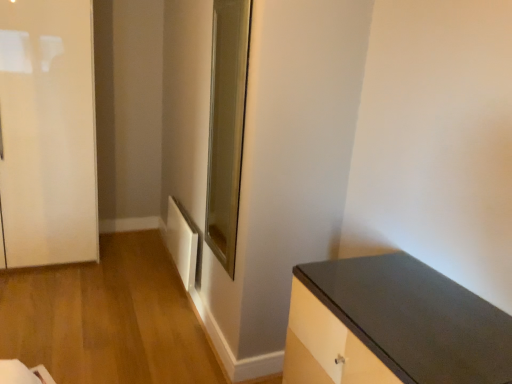
Where is `clear glass door at center`? Image resolution: width=512 pixels, height=384 pixels. clear glass door at center is located at coordinates (227, 126).

What is the approximate height of white glossy door at left?

The height of white glossy door at left is 1.91 meters.

Where is `clear glass door at center`? clear glass door at center is located at coordinates (227, 126).

From the picture: From the image's perspective, does white glossy door at left appear lower than matte black countertop at lower right?

No, from the image's perspective, white glossy door at left is not beneath matte black countertop at lower right.

From a real-world perspective, between white glossy door at left and matte black countertop at lower right, who is vertically lower?

matte black countertop at lower right is physically lower.

Would you say white glossy door at left is outside matte black countertop at lower right?

Absolutely, white glossy door at left is external to matte black countertop at lower right.

Does point (47, 171) appear closer or farther from the camera than point (371, 354)?

Point (47, 171).

From the image's perspective, between white matte radiator at lower left and matte black countertop at lower right, who is located below?

matte black countertop at lower right is shown below in the image.

Is white matte radiator at lower left not close to matte black countertop at lower right?

white matte radiator at lower left is positioned a significant distance from matte black countertop at lower right.

Does white matte radiator at lower left have a larger size compared to matte black countertop at lower right?

Actually, white matte radiator at lower left might be smaller than matte black countertop at lower right.

In terms of height, does white matte radiator at lower left look taller or shorter compared to matte black countertop at lower right?

In the image, white matte radiator at lower left appears to be shorter than matte black countertop at lower right.

Which is closer, [29,254] or [185,238]?

The point [185,238] is closer.

Is white glossy door at left directly adjacent to white matte radiator at lower left?

No, white glossy door at left is not next to white matte radiator at lower left.

Is white glossy door at left positioned behind white matte radiator at lower left?

No, it is in front of white matte radiator at lower left.

Is white glossy door at left with clear glass door at center?

white glossy door at left is not next to clear glass door at center, and they're not touching.

From the image's perspective, is white glossy door at left below clear glass door at center?

No, from the image's perspective, white glossy door at left is not below clear glass door at center.

Between white glossy door at left and clear glass door at center, which one appears on the left side from the viewer's perspective?

white glossy door at left is more to the left.

Looking at this image, could you tell me if white glossy door at left is turned towards clear glass door at center?

No, white glossy door at left does not turn towards clear glass door at center.

Which of these two, clear glass door at center or white matte radiator at lower left, is bigger?

clear glass door at center is bigger.

In the scene shown: Can you tell me how much clear glass door at center and white matte radiator at lower left differ in facing direction?

The facing directions of clear glass door at center and white matte radiator at lower left are 1.74 degrees apart.

Considering the relative positions of clear glass door at center and white matte radiator at lower left in the image provided, is clear glass door at center to the left of white matte radiator at lower left from the viewer's perspective?

In fact, clear glass door at center is to the right of white matte radiator at lower left.

Locate an element on the screen. This screenshot has width=512, height=384. radiator below the clear glass door at center (from a real-world perspective) is located at coordinates (182, 242).

From the image's perspective, is matte black countertop at lower right located beneath clear glass door at center?

Yes, from the image's perspective, matte black countertop at lower right is beneath clear glass door at center.

Between matte black countertop at lower right and clear glass door at center, which one is positioned behind?

clear glass door at center.

Would you say matte black countertop at lower right is to the left or to the right of clear glass door at center in the picture?

Based on their positions, matte black countertop at lower right is located to the right of clear glass door at center.

Is matte black countertop at lower right taller or shorter than clear glass door at center?

matte black countertop at lower right is shorter than clear glass door at center.

Relative to white glossy door at left, is clear glass door at center in front or behind?

Clearly, clear glass door at center is in front of white glossy door at left.

Considering the sizes of clear glass door at center and white glossy door at left in the image, is clear glass door at center wider or thinner than white glossy door at left?

clear glass door at center is thinner than white glossy door at left.

Is clear glass door at center oriented away from white glossy door at left?

clear glass door at center does not have its back to white glossy door at left.

What are the coordinates of `glass door that is in front of the white glossy door at left` in the screenshot? It's located at (227, 126).

The height and width of the screenshot is (384, 512). In the image, there is a white glossy door at left. In order to click on countertop below it (from the image's perspective) in this screenshot , I will do `click(392, 326)`.

In the image, there is a matte black countertop at lower right. At what (x,y) coordinates should I click in order to perform the action: click on radiator above it (from the image's perspective). Please return your answer as a coordinate pair (x, y). Looking at the image, I should click on (182, 242).

When comparing their distances from white matte radiator at lower left, does matte black countertop at lower right or white glossy door at left seem closer?

The object closer to white matte radiator at lower left is white glossy door at left.

Estimate the real-world distances between objects in this image. Which object is further from matte black countertop at lower right, white matte radiator at lower left or white glossy door at left?

The object further to matte black countertop at lower right is white glossy door at left.

When comparing their distances from white matte radiator at lower left, does white glossy door at left or matte black countertop at lower right seem further?

Among the two, matte black countertop at lower right is located further to white matte radiator at lower left.

When comparing their distances from clear glass door at center, does white glossy door at left or matte black countertop at lower right seem closer?

matte black countertop at lower right lies closer to clear glass door at center than the other object.

When comparing their distances from clear glass door at center, does white glossy door at left or white matte radiator at lower left seem closer?

white matte radiator at lower left.

When comparing their distances from white glossy door at left, does clear glass door at center or white matte radiator at lower left seem closer?

Among the two, white matte radiator at lower left is located nearer to white glossy door at left.

Estimate the real-world distances between objects in this image. Which object is closer to clear glass door at center, white matte radiator at lower left or matte black countertop at lower right?

white matte radiator at lower left is closer to clear glass door at center.

When comparing their distances from matte black countertop at lower right, does white glossy door at left or white matte radiator at lower left seem closer?

white matte radiator at lower left lies closer to matte black countertop at lower right than the other object.

Where is `radiator situated between white glossy door at left and clear glass door at center from left to right`? The image size is (512, 384). radiator situated between white glossy door at left and clear glass door at center from left to right is located at coordinates (182, 242).

Where is `glass door positioned between matte black countertop at lower right and white matte radiator at lower left from near to far`? Image resolution: width=512 pixels, height=384 pixels. glass door positioned between matte black countertop at lower right and white matte radiator at lower left from near to far is located at coordinates (227, 126).

Find the location of `glass door situated between white glossy door at left and matte black countertop at lower right from left to right`. glass door situated between white glossy door at left and matte black countertop at lower right from left to right is located at coordinates [227, 126].

You are a GUI agent. You are given a task and a screenshot of the screen. Output one action in this format:
    pyautogui.click(x=<x>, y=<y>)
    Task: Click on the radiator between white glossy door at left and matte black countertop at lower right
    
    Given the screenshot: What is the action you would take?
    pyautogui.click(x=182, y=242)